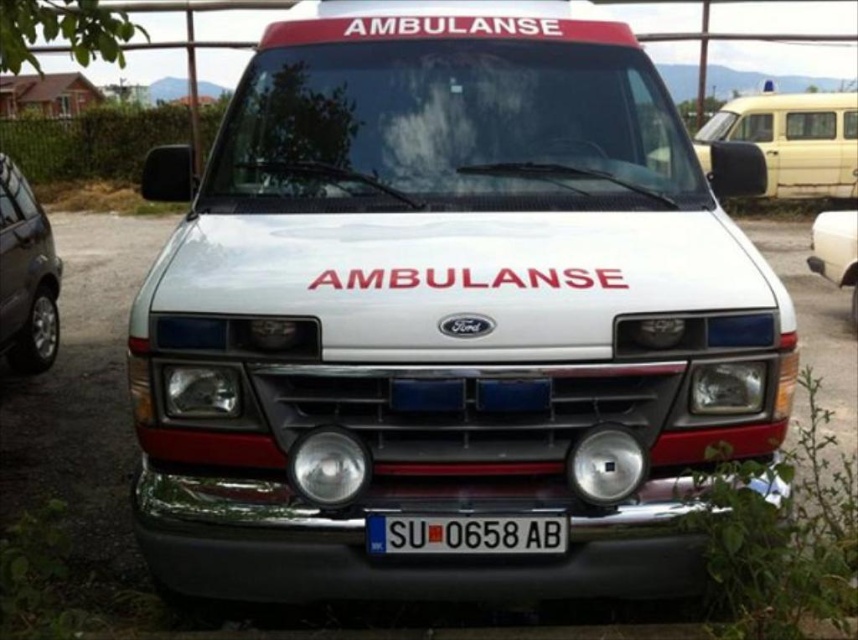
You are a delivery driver who needs to park your truck between the yellow matte van at right and the white glossy van at center. The length of your truck is 6 meters. Can you fit your truck between them without overlapping either van?

The yellow matte van at right is 7.32 meters from the white glossy van at center. Since your truck is 6 meters long, you can fit your truck between them without overlapping either van because the distance between the two vans is greater than the length of your truck.

You are a photographer taking a picture of the Ford ambulance. You notice two points on the ambulance, one at point coordinates point (795, 115) and another at point (0, 330). Which point will appear closer to the camera in the photo?

Point (0, 330) will appear closer to the camera in the photo because it is closer to the camera than point (795, 115), which is further away.

You are a pedestrian standing in front of the Ford ambulance. You need to cross the road safely. There are two vehicles nearby, the yellow matte van at right and the metallic gray car at left. Which vehicle is closer to you so you can wait behind it for safety?

The yellow matte van at right is closer to the viewer than metallic gray car at left, so you should wait behind the yellow matte van at right for safety.